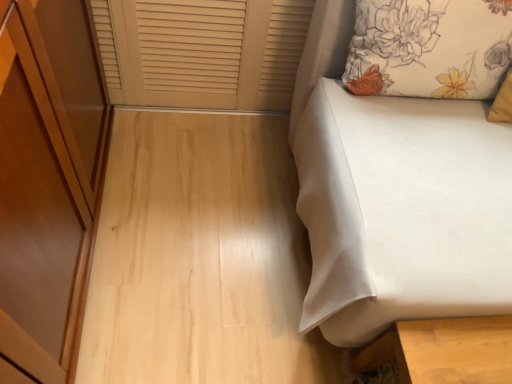
Question: Considering the positions of white fabric bed at right and beige wood window frame at upper left in the image, is white fabric bed at right wider or thinner than beige wood window frame at upper left?

Choices:
 (A) wide
 (B) thin

Answer: (A)

Question: In terms of height, does white fabric bed at right look taller or shorter compared to beige wood window frame at upper left?

Choices:
 (A) tall
 (B) short

Answer: (A)

Question: Which object is positioned closest to the beige wood window frame at upper left?

Choices:
 (A) white fabric bed at right
 (B) floral fabric pillow at upper right

Answer: (B)

Question: Which object is positioned farthest from the white fabric bed at right?

Choices:
 (A) floral fabric pillow at upper right
 (B) beige wood window frame at upper left

Answer: (B)